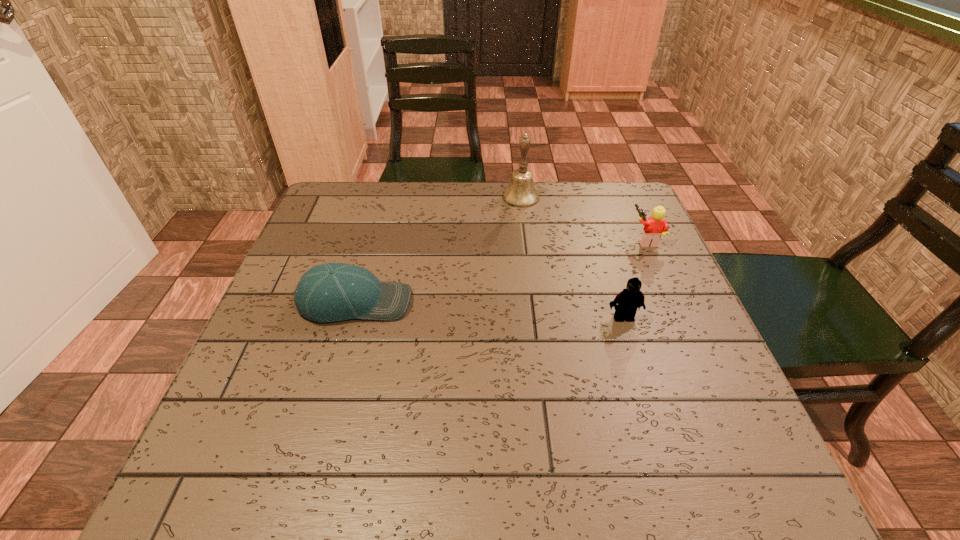
Identify the location of free space between the farthest object and the second farthest object. (584, 218).

The width and height of the screenshot is (960, 540). I want to click on vacant point located between the left Lego and the leftmost object, so click(490, 310).

The width and height of the screenshot is (960, 540). Identify the location of vacant space that's between the shortest object and the left Lego. (490, 310).

What are the coordinates of `vacant space in between the third object from left to right and the shortest object` in the screenshot? It's located at (490, 310).

Select which object appears as the third closest to the shortest object. Please provide its 2D coordinates. Your answer should be formatted as a tuple, i.e. [(x, y)], where the tuple contains the x and y coordinates of a point satisfying the conditions above.

[(655, 226)]

Locate which object is the closest to the shortest object. Please provide its 2D coordinates. Your answer should be formatted as a tuple, i.e. [(x, y)], where the tuple contains the x and y coordinates of a point satisfying the conditions above.

[(521, 192)]

The width and height of the screenshot is (960, 540). Identify the location of blank space that satisfies the following two spatial constraints: 1. on the back side of the farthest object; 2. on the right side of the shortest object. (385, 197).

Where is `vacant point that satisfies the following two spatial constraints: 1. in front of the rightmost object with the accessory visible; 2. on the face of the nearer Lego`? The image size is (960, 540). vacant point that satisfies the following two spatial constraints: 1. in front of the rightmost object with the accessory visible; 2. on the face of the nearer Lego is located at coordinates (681, 318).

I want to click on vacant position in the image that satisfies the following two spatial constraints: 1. on the back side of the baseball cap; 2. on the right side of the bell, so click(385, 197).